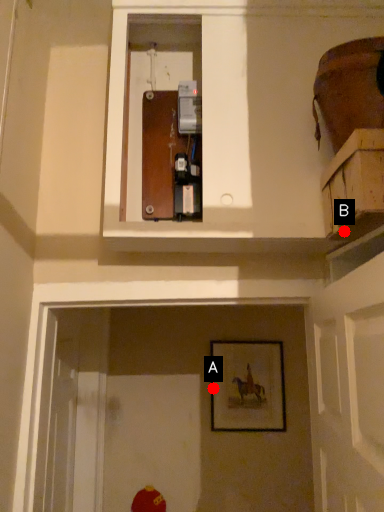
Question: Two points are circled on the image, labeled by A and B beside each circle. Which point appears farthest from the camera in this image?

Choices:
 (A) A is further
 (B) B is further

Answer: (A)